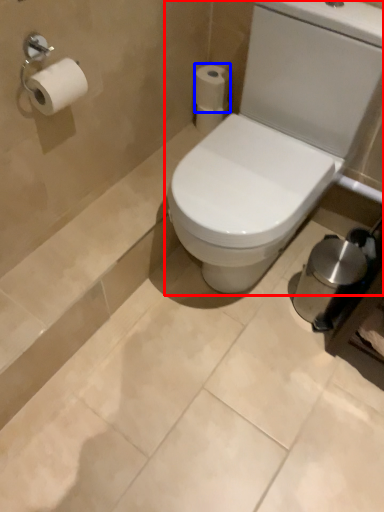
Question: Among these objects, which one is nearest to the camera, toilet (highlighted by a red box) or toilet paper (highlighted by a blue box)?

Choices:
 (A) toilet
 (B) toilet paper

Answer: (A)